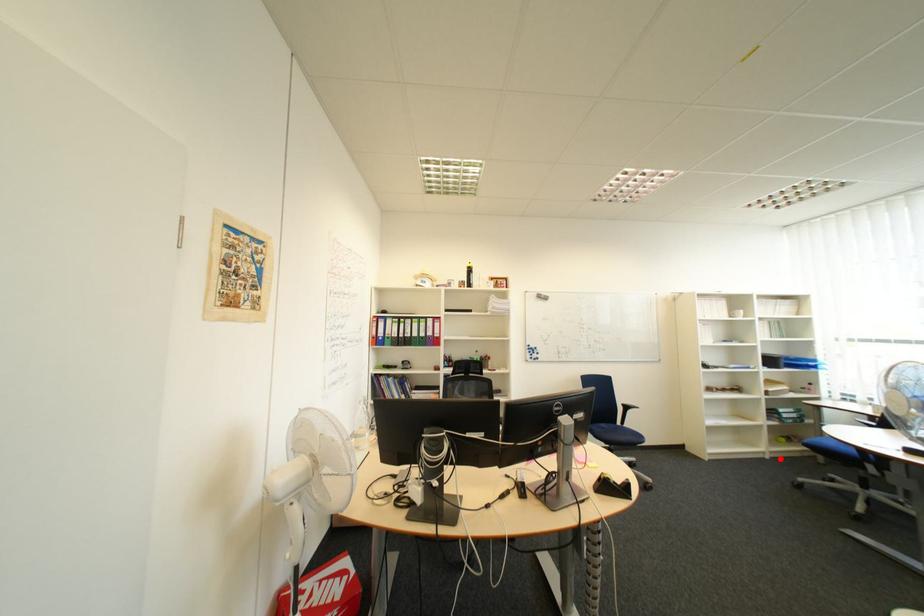
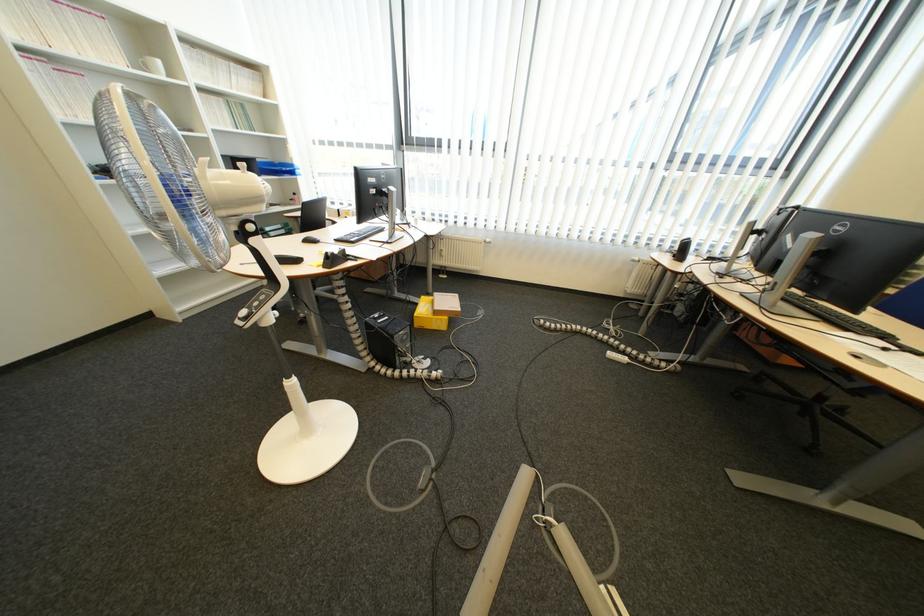
Where in the second image is the point corresponding to the highlighted location from the first image?

(277, 285)